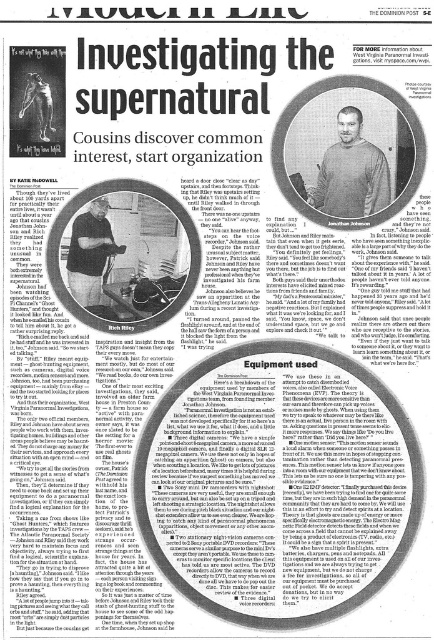
What is the location of the point with coordinates (351, 172) in the image?

The point with coordinates (351, 172) is located on the matte gray sweater at center.

You are a photographer who needs to adjust the lighting between the matte gray sweater at center and the camera. How far apart are they?

The matte gray sweater at center and the camera are 7.32 feet apart.